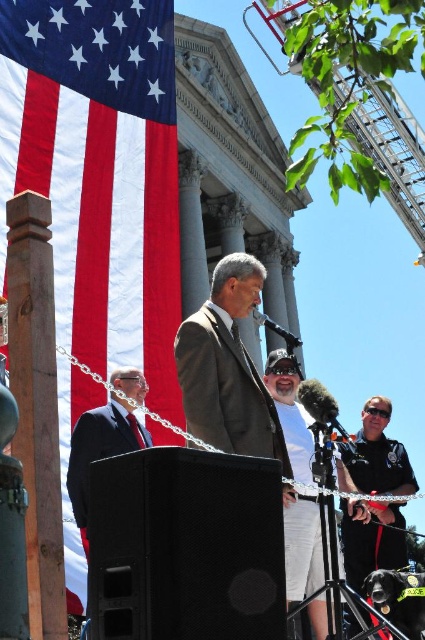
Can you confirm if dark gray suit at center is shorter than white cotton shirt at center?

Yes, dark gray suit at center is shorter than white cotton shirt at center.

Does dark gray suit at center have a greater width compared to white cotton shirt at center?

Yes, dark gray suit at center is wider than white cotton shirt at center.

Who is more forward, (363, 406) or (294, 468)?

Positioned in front is point (294, 468).

Where is `dark gray suit at center`? dark gray suit at center is located at coordinates (376, 456).

Looking at this image, is black matte speaker at lower center wider than dark gray suit at center?

No, black matte speaker at lower center is not wider than dark gray suit at center.

Is black matte speaker at lower center to the right of dark gray suit at center from the viewer's perspective?

In fact, black matte speaker at lower center is to the left of dark gray suit at center.

In order to click on black matte speaker at lower center in this screenshot , I will do `click(186, 547)`.

The height and width of the screenshot is (640, 425). What do you see at coordinates (99, 172) in the screenshot?
I see `red fabric flag at left` at bounding box center [99, 172].

Is red fabric flag at left above black matte speaker at lower center?

Correct, red fabric flag at left is located above black matte speaker at lower center.

Measure the distance between point (84, 289) and camera.

Point (84, 289) is 54.65 meters from camera.

I want to click on red fabric flag at left, so click(x=99, y=172).